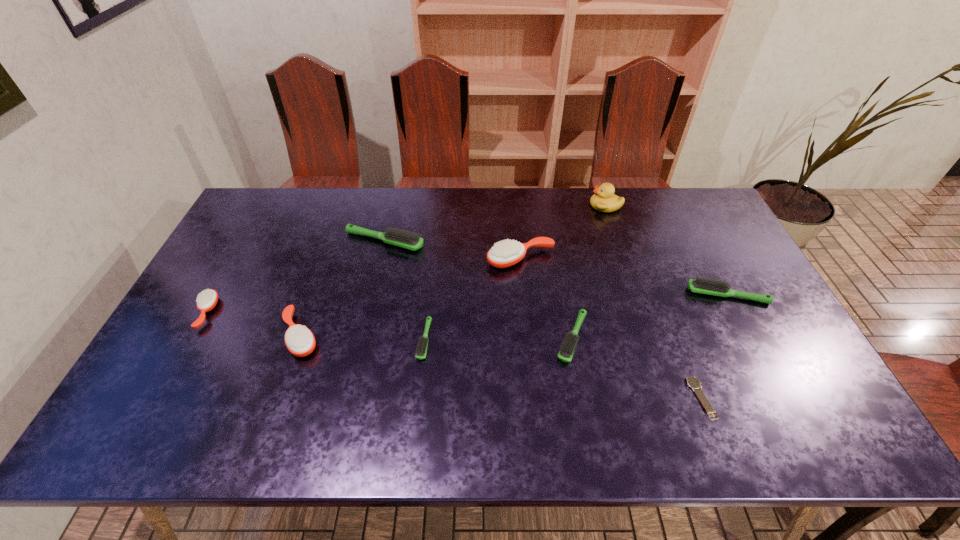
Where is `the sixth closest object to the leftmost light hairbrush`? The height and width of the screenshot is (540, 960). the sixth closest object to the leftmost light hairbrush is located at coordinates (604, 200).

I want to click on the second closest hairbrush relative to the rightmost light hairbrush, so click(504, 254).

Locate an element on the screen. Image resolution: width=960 pixels, height=540 pixels. hairbrush that can be found as the fourth closest to the fourth hairbrush from right to left is located at coordinates (565, 354).

Locate an element on the screen. This screenshot has height=540, width=960. orange hairbrush that is the second closest to the smallest orange hairbrush is located at coordinates (504, 254).

Locate which orange hairbrush is the closest to the seventh tallest object. Please provide its 2D coordinates. Your answer should be formatted as a tuple, i.e. [(x, y)], where the tuple contains the x and y coordinates of a point satisfying the conditions above.

[(504, 254)]

Identify which light hairbrush is the second nearest to the fourth hairbrush from left to right. Please provide its 2D coordinates. Your answer should be formatted as a tuple, i.e. [(x, y)], where the tuple contains the x and y coordinates of a point satisfying the conditions above.

[(565, 354)]

Find the location of `the second closest light hairbrush to the second orange hairbrush from left to right`. the second closest light hairbrush to the second orange hairbrush from left to right is located at coordinates (421, 349).

The image size is (960, 540). I want to click on free space that satisfies the following two spatial constraints: 1. on the front-facing side of the tallest object; 2. on the left side of the watch, so click(668, 398).

The image size is (960, 540). I want to click on free region that satisfies the following two spatial constraints: 1. on the front-facing side of the farthest object; 2. on the right side of the watch, so click(668, 398).

In order to click on vacant region that satisfies the following two spatial constraints: 1. on the front-facing side of the rightmost light hairbrush; 2. on the left side of the yellow duckling in this screenshot , I will do `click(635, 295)`.